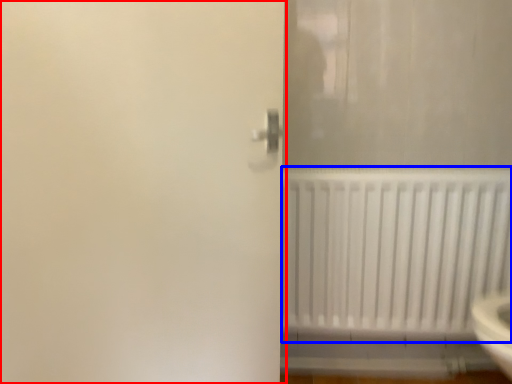
Question: Which object is further to the camera taking this photo, screen door (highlighted by a red box) or radiator (highlighted by a blue box)?

Choices:
 (A) screen door
 (B) radiator

Answer: (B)